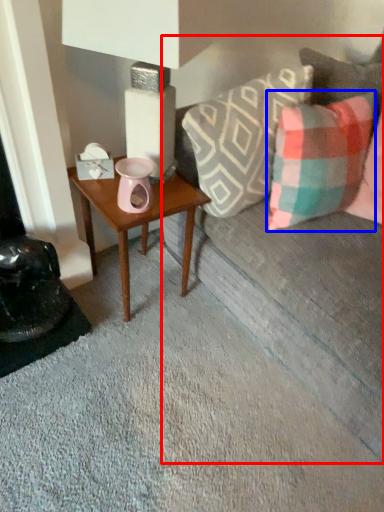
Question: Among these objects, which one is farthest to the camera, studio couch (highlighted by a red box) or pillow (highlighted by a blue box)?

Choices:
 (A) studio couch
 (B) pillow

Answer: (B)